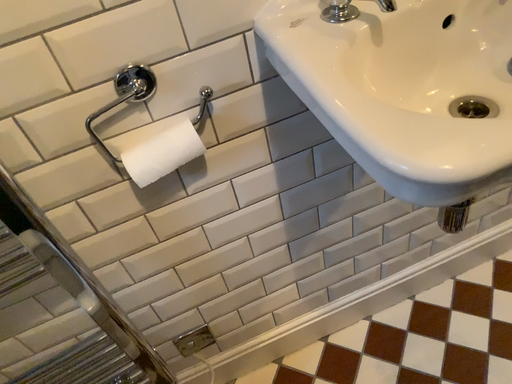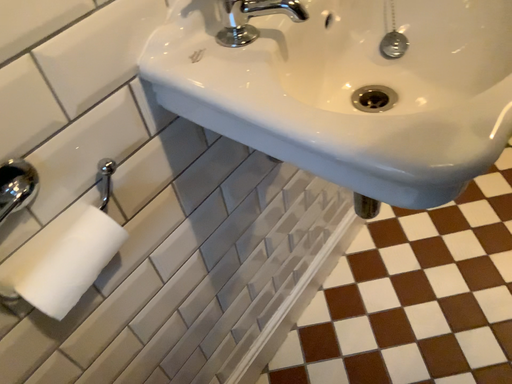
Question: Which way did the camera rotate in the video?

Choices:
 (A) rotated downward
 (B) rotated upward

Answer: (B)